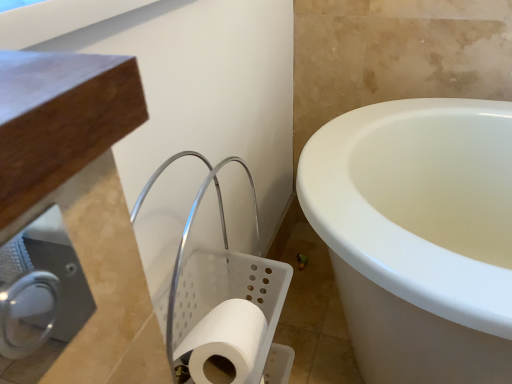
Describe the element at coordinates (226, 339) in the screenshot. I see `white matte toilet paper at lower center` at that location.

In order to face white matte toilet paper at lower center, should I rotate leftwards or rightwards?

Turn left approximately 2.020 degrees to face it.

The height and width of the screenshot is (384, 512). I want to click on white matte toilet paper at lower center, so click(x=226, y=339).

What do you see at coordinates (41, 287) in the screenshot?
I see `satin silver toilet paper holder at lower left` at bounding box center [41, 287].

Where is `satin silver toilet paper holder at lower left`? The width and height of the screenshot is (512, 384). satin silver toilet paper holder at lower left is located at coordinates (41, 287).

In order to click on white matte toilet paper at lower center in this screenshot , I will do `click(226, 339)`.

Is white matte toilet paper at lower center at the right side of satin silver toilet paper holder at lower left?

Yes, white matte toilet paper at lower center is to the right of satin silver toilet paper holder at lower left.

Does white matte toilet paper at lower center come behind satin silver toilet paper holder at lower left?

Yes, it is behind satin silver toilet paper holder at lower left.

Does point (208, 353) come closer to viewer compared to point (57, 242)?

That is True.

From the image's perspective, would you say white matte toilet paper at lower center is positioned over satin silver toilet paper holder at lower left?

Incorrect, from the image's perspective, white matte toilet paper at lower center is lower than satin silver toilet paper holder at lower left.

From a real-world perspective, is white matte toilet paper at lower center over satin silver toilet paper holder at lower left?

Incorrect, from a real-world perspective, white matte toilet paper at lower center is lower than satin silver toilet paper holder at lower left.

Considering the sizes of objects white matte toilet paper at lower center and satin silver toilet paper holder at lower left in the image provided, who is thinner, white matte toilet paper at lower center or satin silver toilet paper holder at lower left?

With smaller width is satin silver toilet paper holder at lower left.

Is white matte toilet paper at lower center shorter than satin silver toilet paper holder at lower left?

No.

Considering the relative sizes of white matte toilet paper at lower center and satin silver toilet paper holder at lower left in the image provided, is white matte toilet paper at lower center smaller than satin silver toilet paper holder at lower left?

Actually, white matte toilet paper at lower center might be larger than satin silver toilet paper holder at lower left.

Is white matte toilet paper at lower center positioned beyond the bounds of satin silver toilet paper holder at lower left?

Yes, white matte toilet paper at lower center is located beyond the bounds of satin silver toilet paper holder at lower left.

Would you consider white matte toilet paper at lower center to be distant from satin silver toilet paper holder at lower left?

No.

Is white matte toilet paper at lower center aimed at satin silver toilet paper holder at lower left?

No.

Locate an element on the screen. The width and height of the screenshot is (512, 384). toilet paper on the right of satin silver toilet paper holder at lower left is located at coordinates (226, 339).

Between satin silver toilet paper holder at lower left and white matte toilet paper at lower center, which one appears on the left side from the viewer's perspective?

satin silver toilet paper holder at lower left is more to the left.

Is satin silver toilet paper holder at lower left closer to the viewer compared to white matte toilet paper at lower center?

Yes, it is.

Which is behind, point (1, 260) or point (234, 340)?

The point (234, 340) is more distant.

From the image's perspective, between satin silver toilet paper holder at lower left and white matte toilet paper at lower center, which one is located above?

satin silver toilet paper holder at lower left, from the image's perspective.

From a real-world perspective, is satin silver toilet paper holder at lower left above or below white matte toilet paper at lower center?

From a real-world perspective, satin silver toilet paper holder at lower left is physically above white matte toilet paper at lower center.

Can you confirm if satin silver toilet paper holder at lower left is wider than white matte toilet paper at lower center?

In fact, satin silver toilet paper holder at lower left might be narrower than white matte toilet paper at lower center.

From their relative heights in the image, would you say satin silver toilet paper holder at lower left is taller or shorter than white matte toilet paper at lower center?

satin silver toilet paper holder at lower left is shorter than white matte toilet paper at lower center.

Does satin silver toilet paper holder at lower left have a larger size compared to white matte toilet paper at lower center?

No.

Is satin silver toilet paper holder at lower left outside of white matte toilet paper at lower center?

Yes, satin silver toilet paper holder at lower left is outside of white matte toilet paper at lower center.

Are satin silver toilet paper holder at lower left and white matte toilet paper at lower center located far from each other?

No, satin silver toilet paper holder at lower left is not far from white matte toilet paper at lower center.

Is satin silver toilet paper holder at lower left facing towards white matte toilet paper at lower center?

No, satin silver toilet paper holder at lower left is not oriented towards white matte toilet paper at lower center.

How far apart are satin silver toilet paper holder at lower left and white matte toilet paper at lower center?

The distance of satin silver toilet paper holder at lower left from white matte toilet paper at lower center is 14.62 inches.

Where is `toilet paper below the satin silver toilet paper holder at lower left (from a real-world perspective)`? The image size is (512, 384). toilet paper below the satin silver toilet paper holder at lower left (from a real-world perspective) is located at coordinates click(x=226, y=339).

Identify the location of dispenser above the white matte toilet paper at lower center (from the image's perspective). (41, 287).

Where is `toilet paper below the satin silver toilet paper holder at lower left (from a real-world perspective)`? The image size is (512, 384). toilet paper below the satin silver toilet paper holder at lower left (from a real-world perspective) is located at coordinates (226, 339).